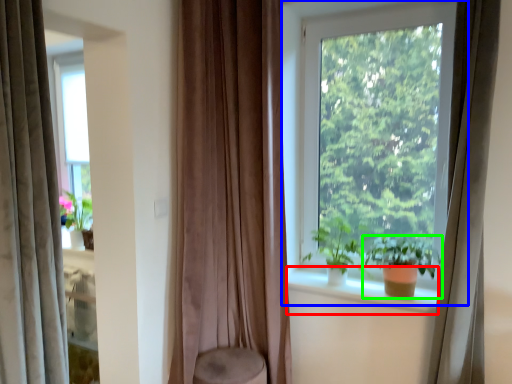
Question: Considering the real-world distances, which object is closest to window sill (highlighted by a red box)? window (highlighted by a blue box) or houseplant (highlighted by a green box).

Choices:
 (A) window
 (B) houseplant

Answer: (B)